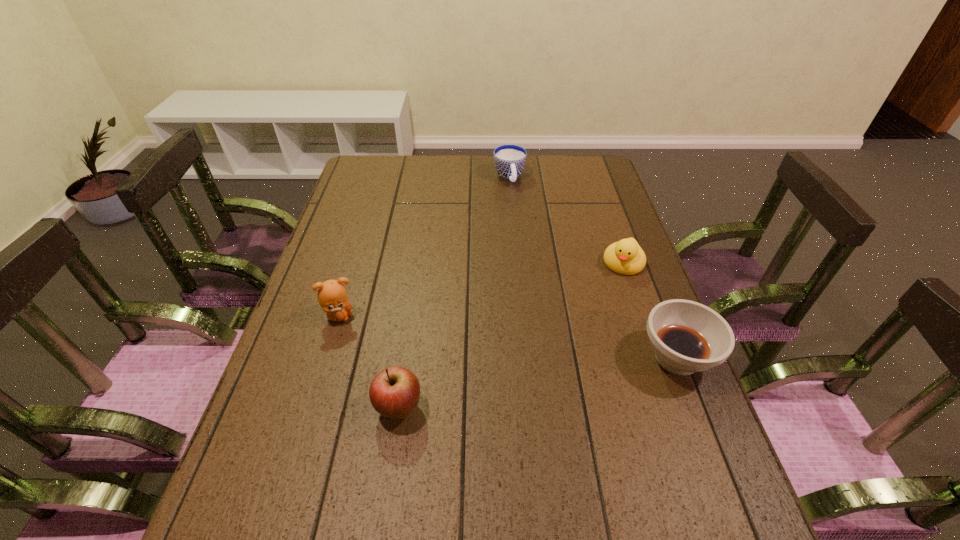
You are a GUI agent. You are given a task and a screenshot of the screen. Output one action in this format:
    pyautogui.click(x=<x>, y=<y>)
    Task: Click on the free point that satisfies the following two spatial constraints: 1. on the back side of the cup; 2. on the left side of the leftmost object
    
    Given the screenshot: What is the action you would take?
    pyautogui.click(x=381, y=178)

Where is `free space in the image that satisfies the following two spatial constraints: 1. on the back side of the teddy bear; 2. on the left side of the third object from right to left`? The image size is (960, 540). free space in the image that satisfies the following two spatial constraints: 1. on the back side of the teddy bear; 2. on the left side of the third object from right to left is located at coordinates (381, 178).

This screenshot has width=960, height=540. I want to click on vacant area in the image that satisfies the following two spatial constraints: 1. on the front side of the second farthest object; 2. on the right side of the third object from left to right, so click(516, 263).